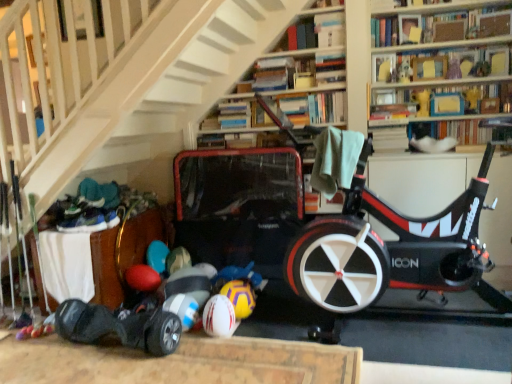
Where is `vacant area that lies to the right of white matte rugby ball at lower center`? This screenshot has width=512, height=384. vacant area that lies to the right of white matte rugby ball at lower center is located at coordinates (250, 335).